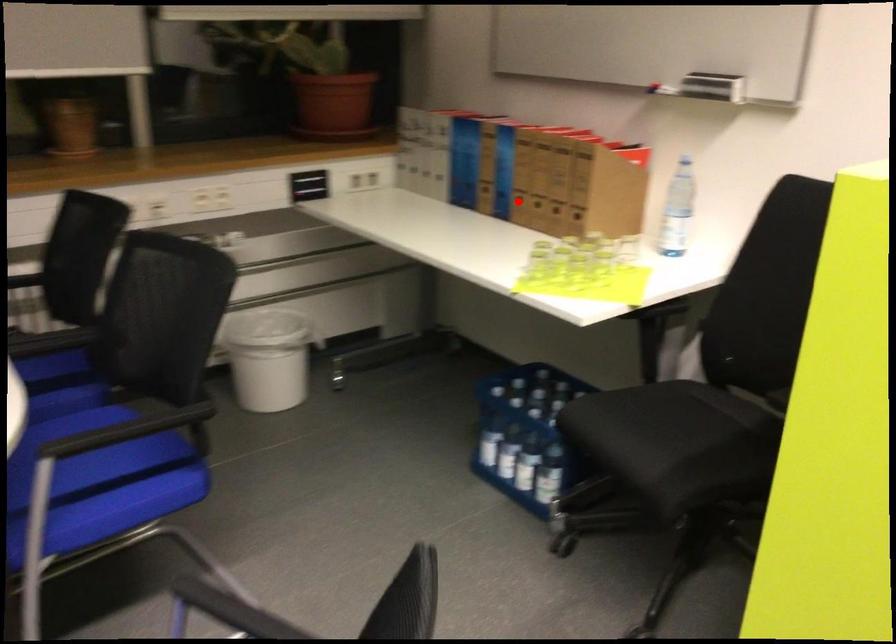
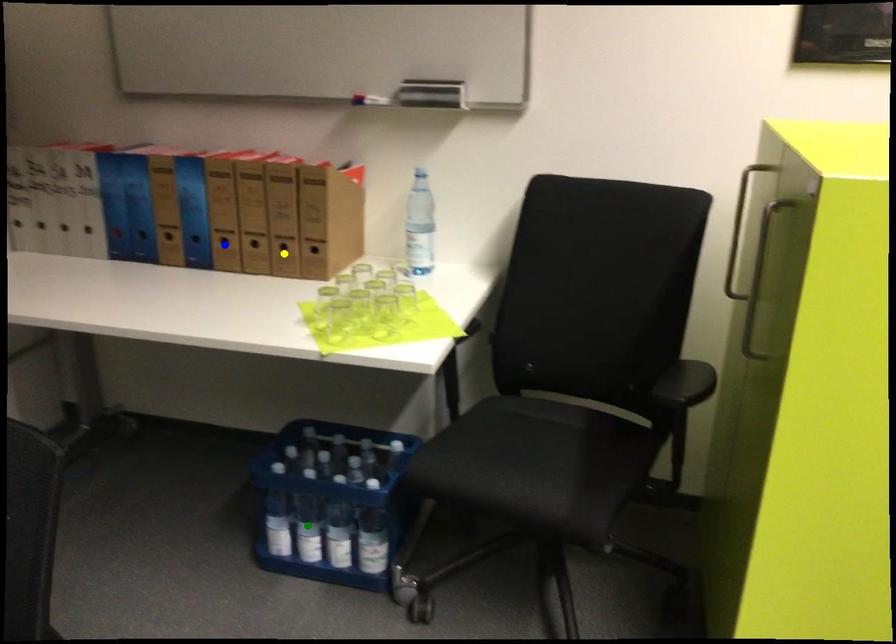
Question: I am providing you with two images of the same scene from different viewpoints. A red point is marked on the first image. You are given multiple points on the second image. Which point in image 2 represents the same 3d spot as the red point in image 1?

Choices:
 (A) blue point
 (B) yellow point
 (C) green point

Answer: (A)